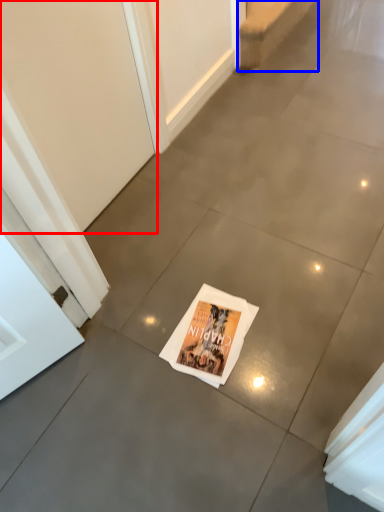
Question: Which object is further to the camera taking this photo, screen door (highlighted by a red box) or stairwell (highlighted by a blue box)?

Choices:
 (A) screen door
 (B) stairwell

Answer: (B)